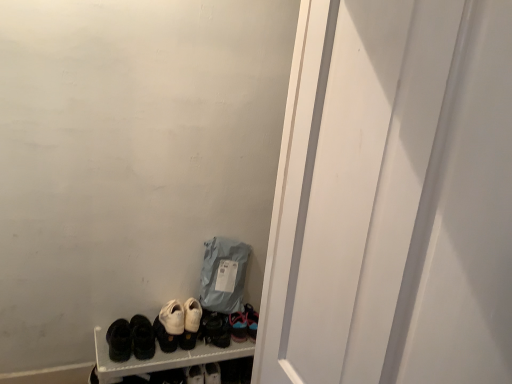
Question: Is matte black shoes at lower left inside black leather sneakers at center, the 1th footwear positioned from the right?

Choices:
 (A) no
 (B) yes

Answer: (A)

Question: Considering the relative sizes of black leather sneakers at center, arranged as the fifth footwear when viewed from the left, and matte black shoes at lower left in the image provided, is black leather sneakers at center, arranged as the fifth footwear when viewed from the left, bigger than matte black shoes at lower left?

Choices:
 (A) no
 (B) yes

Answer: (A)

Question: Is black leather sneakers at center, arranged as the fifth footwear when viewed from the left, to the left of matte black shoes at lower left from the viewer's perspective?

Choices:
 (A) no
 (B) yes

Answer: (A)

Question: Does black leather sneakers at center, arranged as the fifth footwear when viewed from the left, have a lesser height compared to matte black shoes at lower left?

Choices:
 (A) no
 (B) yes

Answer: (B)

Question: Does black leather sneakers at center, the 1th footwear positioned from the right, lie in front of matte black shoes at lower left?

Choices:
 (A) no
 (B) yes

Answer: (A)

Question: Considering the relative sizes of black leather sneakers at center, the 1th footwear positioned from the right, and matte black shoes at lower left in the image provided, is black leather sneakers at center, the 1th footwear positioned from the right, thinner than matte black shoes at lower left?

Choices:
 (A) yes
 (B) no

Answer: (A)

Question: Is white leather sneakers at center, which is counted as the second footwear, starting from the right, aimed at black suede shoes at lower left, the second footwear from the left?

Choices:
 (A) yes
 (B) no

Answer: (B)

Question: Is white leather sneakers at center, which is counted as the second footwear, starting from the right, closer to camera compared to black suede shoes at lower left, placed as the fourth footwear when sorted from right to left?

Choices:
 (A) no
 (B) yes

Answer: (A)

Question: Considering the relative sizes of white leather sneakers at center, which is counted as the second footwear, starting from the right, and black suede shoes at lower left, the second footwear from the left, in the image provided, is white leather sneakers at center, which is counted as the second footwear, starting from the right, shorter than black suede shoes at lower left, the second footwear from the left,?

Choices:
 (A) yes
 (B) no

Answer: (A)

Question: From a real-world perspective, is white leather sneakers at center, which is counted as the second footwear, starting from the right, physically above black suede shoes at lower left, placed as the fourth footwear when sorted from right to left?

Choices:
 (A) yes
 (B) no

Answer: (B)

Question: Can you confirm if white leather sneakers at center, which is counted as the second footwear, starting from the right, is positioned to the right of black suede shoes at lower left, placed as the fourth footwear when sorted from right to left?

Choices:
 (A) yes
 (B) no

Answer: (A)

Question: Is white leather sneakers at center, which is counted as the fourth footwear, starting from the left, smaller than black suede shoes at lower left, the second footwear from the left?

Choices:
 (A) yes
 (B) no

Answer: (A)

Question: Considering the relative positions of white matte screen door at center and matte gray fabric bag at lower center in the image provided, is white matte screen door at center in front of matte gray fabric bag at lower center?

Choices:
 (A) no
 (B) yes

Answer: (B)